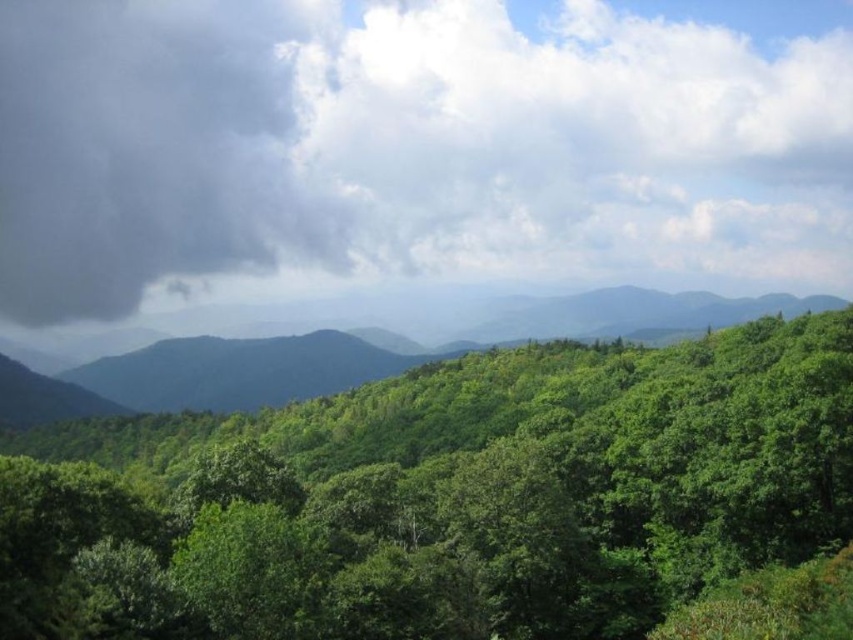
You are standing in the forest and see two points marked in the image. Which point is closer to you, point (268,108) or point (763,429)?

Point (268,108) is closer to you because it is further to the viewer than point (763,429).